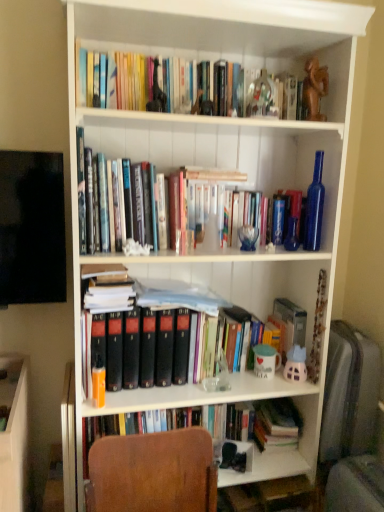
What do you see at coordinates (98, 358) in the screenshot? I see `orange matte book at left` at bounding box center [98, 358].

You are a GUI agent. You are given a task and a screenshot of the screen. Output one action in this format:
    pyautogui.click(x=<x>, y=<y>)
    Task: Click on the orange matte book at left
    
    Given the screenshot: What is the action you would take?
    pyautogui.click(x=98, y=358)

Consider the image. Who is shorter, hardcover books at upper center or brown wooden statue at upper center?

hardcover books at upper center.

Which object is closer to the camera, hardcover books at upper center or brown wooden statue at upper center?

hardcover books at upper center is in front.

Which of these two, hardcover books at upper center or brown wooden statue at upper center, is bigger?

Bigger between the two is hardcover books at upper center.

In the scene shown: From the image's perspective, between hardcover books at upper center and brown wooden statue at upper center, who is located below?

From the image's view, brown wooden statue at upper center is below.

Considering the sizes of orange matte book at left and brown wooden statue at upper center in the image, is orange matte book at left bigger or smaller than brown wooden statue at upper center?

In the image, orange matte book at left appears to be smaller than brown wooden statue at upper center.

Can you confirm if orange matte book at left is taller than brown wooden statue at upper center?

No.

Which is in front, point (101, 361) or point (323, 92)?

Point (101, 361)

Who is more distant, orange matte book at left or brown wooden statue at upper center?

brown wooden statue at upper center is behind.

Visually, is brown wooden statue at upper center positioned to the left or to the right of orange matte book at left?

Based on their positions, brown wooden statue at upper center is located to the right of orange matte book at left.

Consider the image. Can you confirm if brown wooden statue at upper center is bigger than orange matte book at left?

Yes.

Is brown wooden statue at upper center positioned far away from orange matte book at left?

Indeed, brown wooden statue at upper center is not near orange matte book at left.

From a real-world perspective, between brown wooden statue at upper center and orange matte book at left, who is vertically higher?

brown wooden statue at upper center, from a real-world perspective.

Which of these two, hardcover books at upper center or orange matte book at left, stands shorter?

hardcover books at upper center.

How many degrees apart are the facing directions of hardcover books at upper center and orange matte book at left?

They differ by 0.772 degrees in their facing directions.

Can you see hardcover books at upper center touching orange matte book at left?

There is a gap between hardcover books at upper center and orange matte book at left.

Does point (285, 106) come in front of point (95, 376)?

No.

Locate an element on the screen. The height and width of the screenshot is (512, 384). book to the right of orange matte book at left is located at coordinates (178, 86).

Is point (94, 329) in front of point (205, 111)?

That is True.

Would you say orange matte book at left is outside hardcover books at upper center?

Indeed, orange matte book at left is completely outside hardcover books at upper center.

Looking at their sizes, would you say brown wooden statue at upper center is wider or thinner than hardcover books at upper center?

brown wooden statue at upper center is thinner than hardcover books at upper center.

Is brown wooden statue at upper center next to hardcover books at upper center?

No, brown wooden statue at upper center is not touching hardcover books at upper center.

From the image's perspective, is brown wooden statue at upper center over hardcover books at upper center?

No, from the image's perspective, brown wooden statue at upper center is not above hardcover books at upper center.

In the image, there is a hardcover books at upper center. At what (x,y) coordinates should I click in order to perform the action: click on toy below it (from the image's perspective). Please return your answer as a coordinate pair (x, y). This screenshot has width=384, height=512. Looking at the image, I should click on [314, 89].

Where is `paperback book located on the left of brown wooden statue at upper center`? This screenshot has height=512, width=384. paperback book located on the left of brown wooden statue at upper center is located at coordinates (98, 358).

From the image, which object appears to be nearer to hardcover books at upper center, brown wooden statue at upper center or orange matte book at left?

brown wooden statue at upper center.

In the scene shown: Based on their spatial positions, is brown wooden statue at upper center or hardcover books at upper center closer to orange matte book at left?

hardcover books at upper center lies closer to orange matte book at left than the other object.

When comparing their distances from orange matte book at left, does hardcover books at upper center or brown wooden statue at upper center seem further?

Among the two, brown wooden statue at upper center is located further to orange matte book at left.

Estimate the real-world distances between objects in this image. Which object is further from brown wooden statue at upper center, orange matte book at left or hardcover books at upper center?

The object further to brown wooden statue at upper center is orange matte book at left.

Based on their spatial positions, is orange matte book at left or brown wooden statue at upper center closer to hardcover books at upper center?

Among the two, brown wooden statue at upper center is located nearer to hardcover books at upper center.

Based on their spatial positions, is hardcover books at upper center or orange matte book at left further from brown wooden statue at upper center?

orange matte book at left lies further to brown wooden statue at upper center than the other object.

Where is `toy between hardcover books at upper center and orange matte book at left from top to bottom`? toy between hardcover books at upper center and orange matte book at left from top to bottom is located at coordinates (314, 89).